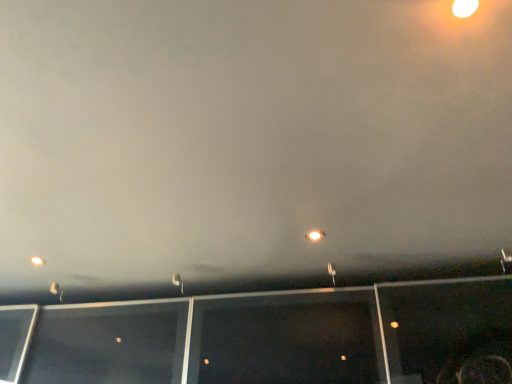
Question: Is the depth of matte white light at center, the first street light in the front-to-back sequence, less than that of metallic silver street light at center, positioned as the third street light in bottom-to-top order?

Choices:
 (A) yes
 (B) no

Answer: (A)

Question: Can you confirm if matte white light at center, the 1th street light from the top, is bigger than metallic silver street light at center, the 3th street light when ordered from back to front?

Choices:
 (A) yes
 (B) no

Answer: (B)

Question: From a real-world perspective, is matte white light at center, the fourth street light positioned from the bottom, located beneath metallic silver street light at center, the 1th street light viewed from the right?

Choices:
 (A) no
 (B) yes

Answer: (A)

Question: Is matte white light at center, the fourth street light positioned from the bottom, to the right of metallic silver street light at center, positioned as the third street light in bottom-to-top order, from the viewer's perspective?

Choices:
 (A) yes
 (B) no

Answer: (B)

Question: From the image's perspective, is matte white light at center, the 2th street light in the right-to-left sequence, above metallic silver street light at center, marked as the second street light in a top-to-bottom arrangement?

Choices:
 (A) yes
 (B) no

Answer: (A)

Question: Are matte white light at center, the 3th street light when ordered from left to right, and metallic silver street light at center, positioned as the third street light in bottom-to-top order, located far from each other?

Choices:
 (A) no
 (B) yes

Answer: (A)

Question: Is metallic street light at lower left, which ranks as the fourth street light in right-to-left order, not close to white plastic street light at center, acting as the 3th street light starting from the right?

Choices:
 (A) yes
 (B) no

Answer: (B)

Question: From the image's perspective, is metallic street light at lower left, the 1th street light viewed from the left, below white plastic street light at center, which appears as the second street light when viewed from the back?

Choices:
 (A) no
 (B) yes

Answer: (B)

Question: Does metallic street light at lower left, which is the 4th street light in top-to-bottom order, come in front of white plastic street light at center, the second street light positioned from the bottom?

Choices:
 (A) yes
 (B) no

Answer: (B)

Question: Is metallic street light at lower left, placed as the 1th street light when sorted from back to front, facing away from white plastic street light at center, the second street light positioned from the bottom?

Choices:
 (A) no
 (B) yes

Answer: (A)

Question: Does metallic street light at lower left, which is the 4th street light in top-to-bottom order, have a smaller size compared to white plastic street light at center, acting as the third street light starting from the top?

Choices:
 (A) yes
 (B) no

Answer: (A)

Question: Is metallic street light at lower left, the 1th street light viewed from the left, bigger than white plastic street light at center, acting as the 3th street light starting from the right?

Choices:
 (A) yes
 (B) no

Answer: (B)

Question: Does metallic street light at lower left, placed as the 4th street light when sorted from front to back, contain metallic silver street light at center, positioned as the third street light in bottom-to-top order?

Choices:
 (A) yes
 (B) no

Answer: (B)